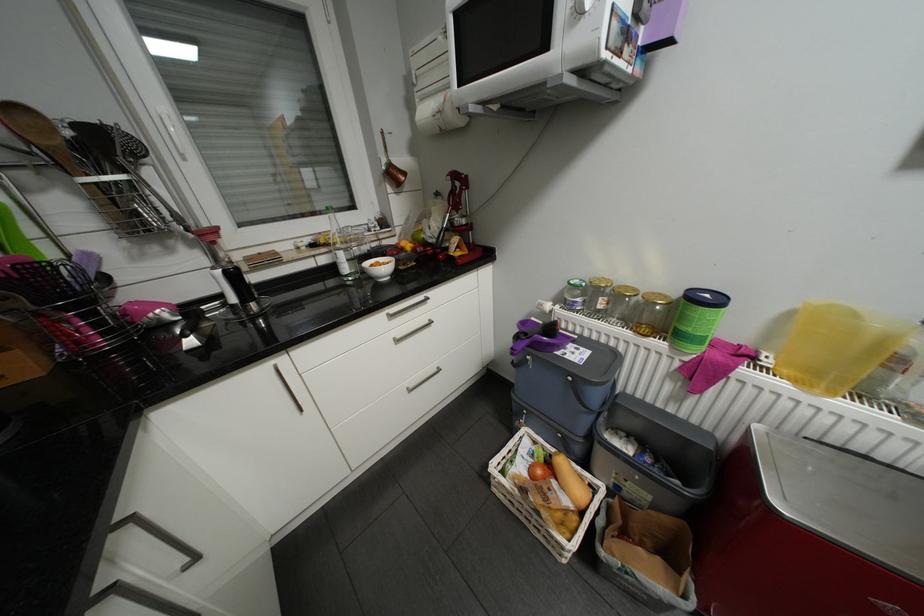
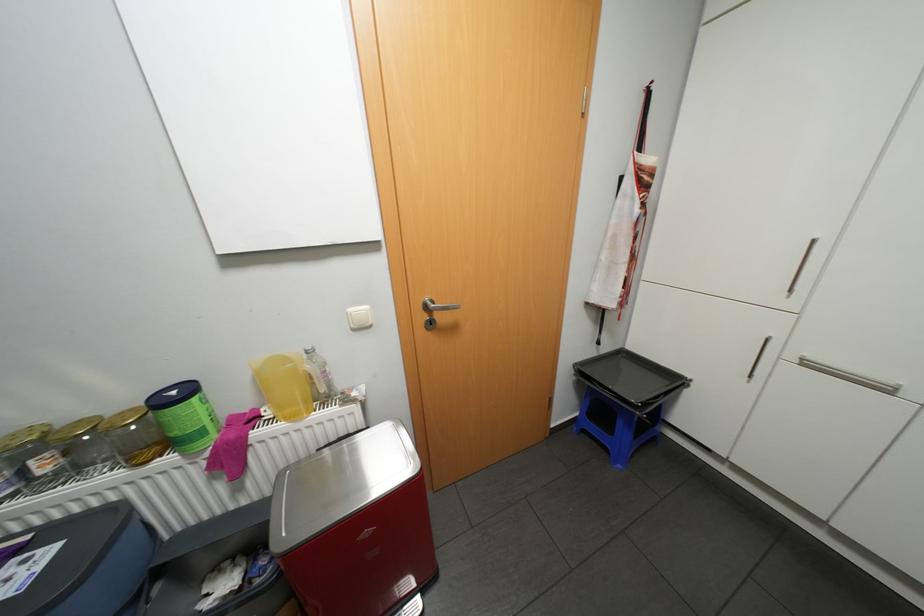
Where in the second image is the point corresponding to the point at 775,361 from the first image?

(275, 413)